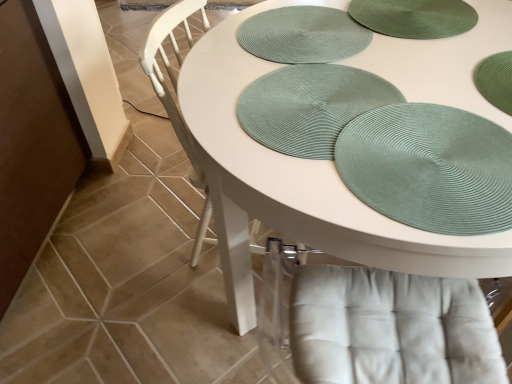
You are a GUI agent. You are given a task and a screenshot of the screen. Output one action in this format:
    pyautogui.click(x=<x>, y=<y>)
    Task: Click on the free spot above green textured placemat at upper center, which ranks as the 2th platter in front-to-back order (from a real-world perspective)
    Image resolution: width=512 pixels, height=384 pixels.
    Given the screenshot: What is the action you would take?
    pyautogui.click(x=297, y=34)